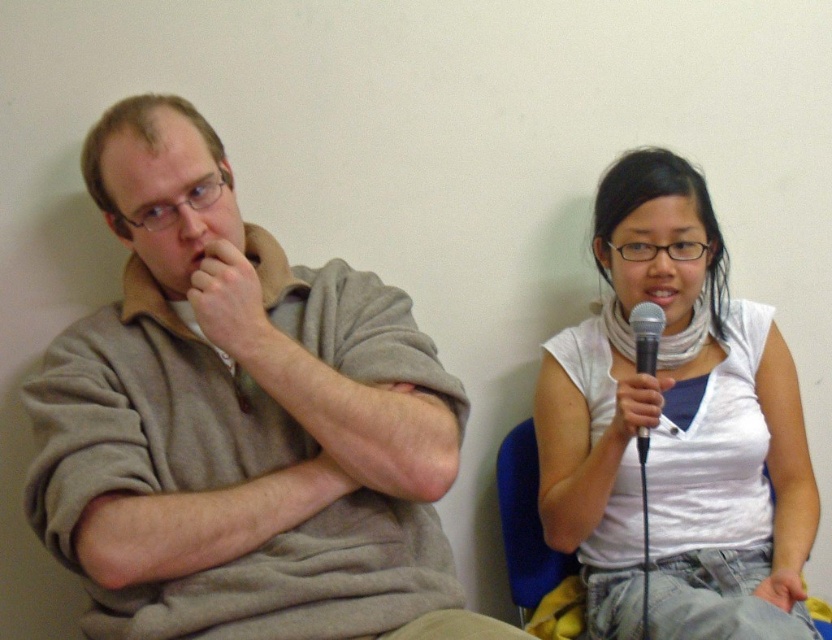
You are a photographer setting up for a portrait shoot. You need to ensure that the matte gray sweater at left and the black metallic microphone at upper right are both visible in the frame. Based on their positions, which object is closer to the camera?

The matte gray sweater at left is closer to the camera because it is in front of the black metallic microphone at upper right.

You are organizing a small event and need to decide whether to place a decorative stand for the black metallic microphone at upper right next to the white matte scarf at right. Considering their sizes, which one should be placed first to ensure they both fit on the table?

The white matte scarf at right is bigger than the black metallic microphone at upper right, so you should place the white matte scarf at right first to ensure both items fit on the table.

You are a photographer setting up for a portrait session. You have a camera focused on the matte gray sweater at left. The subject wants to move closer to the camera so that the sweater is now 2 feet away. Is this adjustment possible without moving the camera?

The matte gray sweater at left is currently 3.32 feet away from the camera. If the subject moves closer to make the sweater 2 feet away, this adjustment is possible as the distance can be reduced by moving the subject forward.